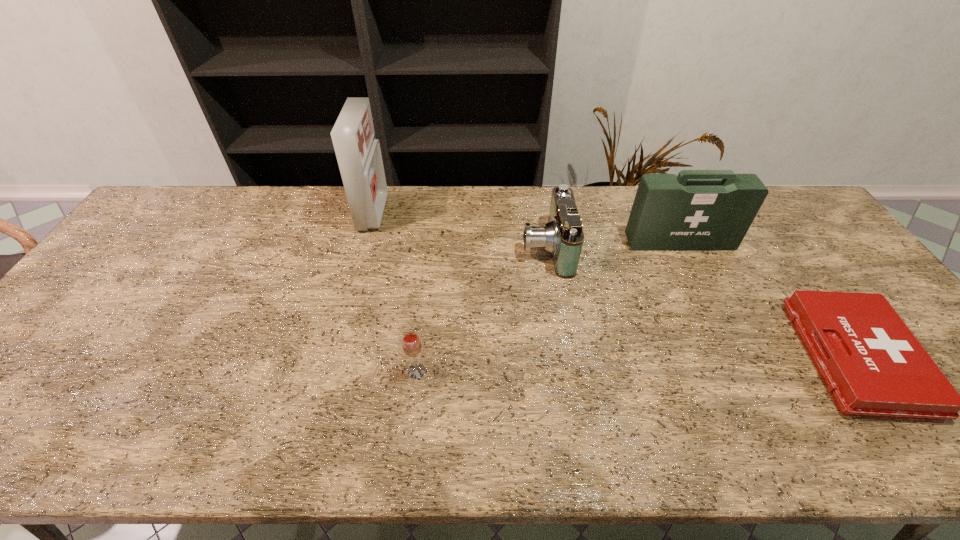
The image size is (960, 540). What are the coordinates of `free location located on the front-facing side of the third object from right to left` in the screenshot? It's located at (432, 248).

Locate an element on the screen. The width and height of the screenshot is (960, 540). vacant region located on the left of the fourth object from right to left is located at coordinates (253, 371).

Locate an element on the screen. the first-aid kit that is at the far edge is located at coordinates (358, 152).

At what (x,y) coordinates should I click in order to perform the action: click on camcorder located at the far edge. Please return your answer as a coordinate pair (x, y). Looking at the image, I should click on (562, 236).

At what (x,y) coordinates should I click in order to perform the action: click on vacant space at the far edge of the desktop. Please return your answer as a coordinate pair (x, y). The width and height of the screenshot is (960, 540). Looking at the image, I should click on (409, 185).

I want to click on free space at the near edge of the desktop, so 56,433.

Locate an element on the screen. vacant area at the left edge is located at coordinates point(144,277).

This screenshot has width=960, height=540. What are the coordinates of `free space that is in between the tallest first-aid kit and the camcorder` in the screenshot? It's located at (460, 230).

The height and width of the screenshot is (540, 960). Identify the location of free spot between the leftmost object and the third object from right to left. (460, 230).

The width and height of the screenshot is (960, 540). In order to click on unoccupied position between the third object from left to right and the wineglass in this screenshot , I will do `click(481, 309)`.